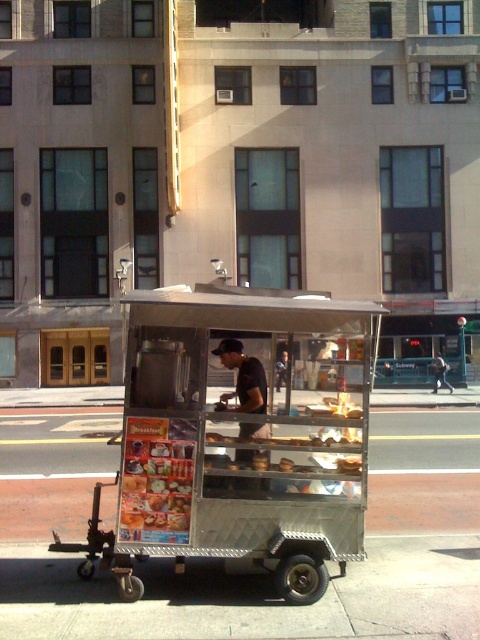
Question: Which point is closer to the camera?

Choices:
 (A) (252, 428)
 (B) (433, 388)

Answer: (A)

Question: Estimate the real-world distances between objects in this image. Which object is farther from the brushed metal pavement at lower center?

Choices:
 (A) metallic silver food cart at center
 (B) dark blue uniform at center
 (C) metallic silver cart at center

Answer: (B)

Question: Can you confirm if metallic silver food cart at center is positioned below brushed metal pavement at lower center?

Choices:
 (A) yes
 (B) no

Answer: (B)

Question: Is metallic silver cart at center to the left of dark blue uniform at center from the viewer's perspective?

Choices:
 (A) yes
 (B) no

Answer: (A)

Question: Estimate the real-world distances between objects in this image. Which object is farther from the metallic silver food cart at center?

Choices:
 (A) dark blue uniform at center
 (B) brushed metal pavement at lower center

Answer: (A)

Question: Can you confirm if metallic silver food cart at center is bigger than dark blue uniform at center?

Choices:
 (A) no
 (B) yes

Answer: (A)